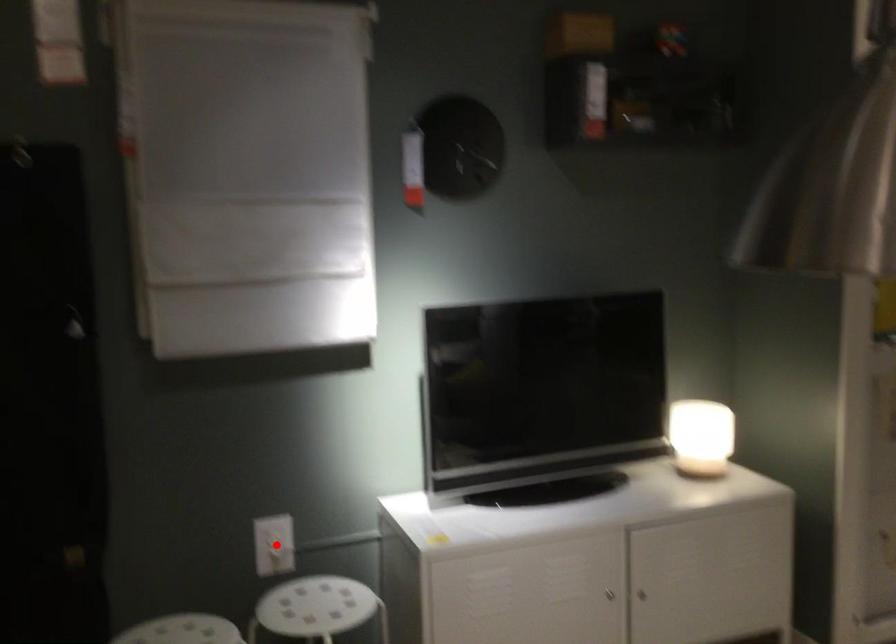
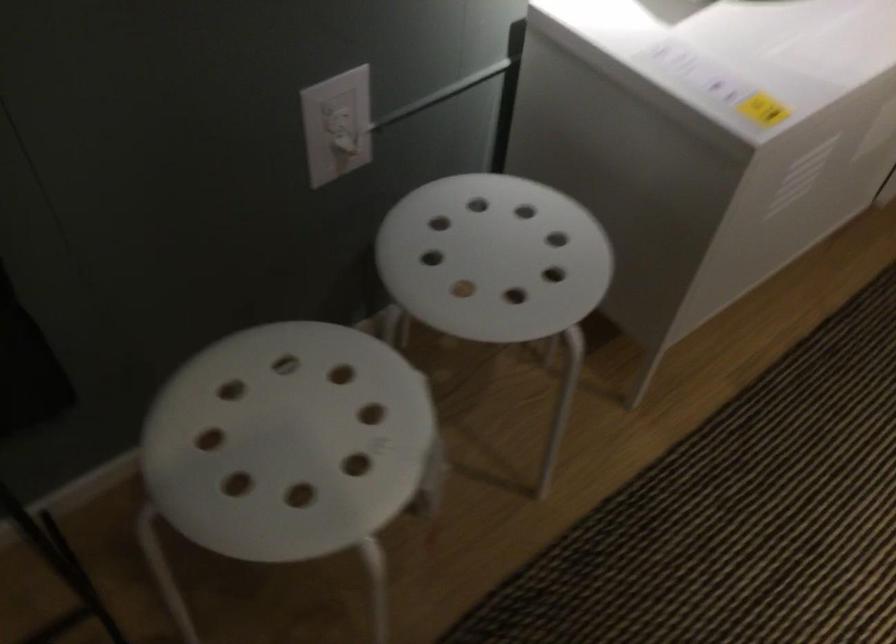
Question: I am providing you with two images of the same scene from different viewpoints. A red point is marked on the first image. Is the red point's position out of view in image 2?

Choices:
 (A) Yes
 (B) No

Answer: (B)